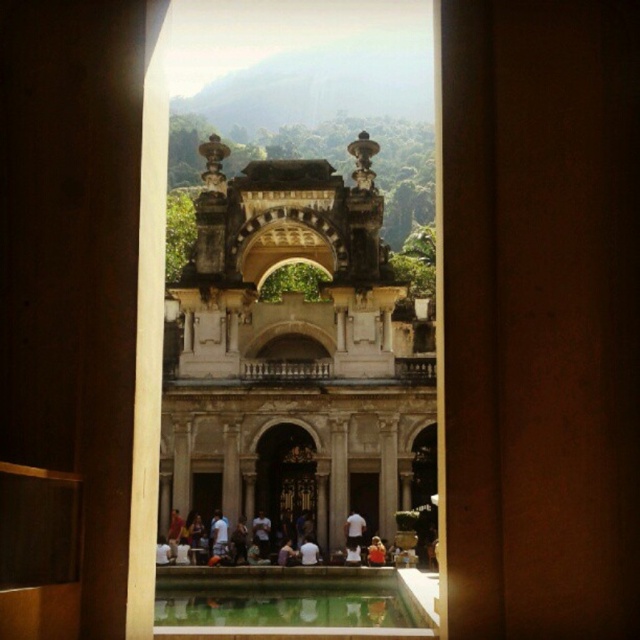
You are standing in the courtyard and want to look through the transparent glass window at center to see the view outside. Based on its position, can you estimate where exactly the window is located relative to the arched doorway and the pool?

The transparent glass window at center is located at point coordinates, so it is positioned centrally within the scene, likely above the arched doorway and facing the pool area, allowing a clear view towards the courtyard and the pool below.

You are standing in front of the courtyard structure and want to reach the point marked as point (380,88). Considering the pool and the people around it, is there enough space to walk directly to that point?

The distance between you and point (380,88) is 402.15 feet, which is quite far. However, the presence of the pool and people might block your path. Since the pool is rectangular and people are gathered around it, you may need to walk around them or the pool to reach the point safely.

You are standing in the courtyard and want to locate the green polished stone pool at center. According to the coordinates provided, where would you find it?

The green polished stone pool at center is located at coordinates point (284, 596).